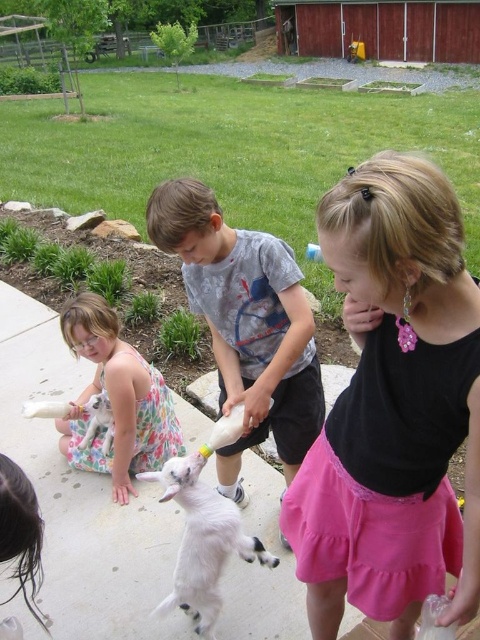
You are a photographer trying to capture the children and animals in the scene. You notice the floral dress at lower left and the white fluffy lamb at center. Which object is blocking the view of the other?

The floral dress at lower left is positioned over the white fluffy lamb at center, so it is blocking the view of the lamb.

You are a photographer trying to capture a photo of the white fluffy lamb at center and the floral dress at lower left. From the photographer position, which object is positioned to the left?

The floral dress at lower left is positioned to the left of the white fluffy lamb at center.